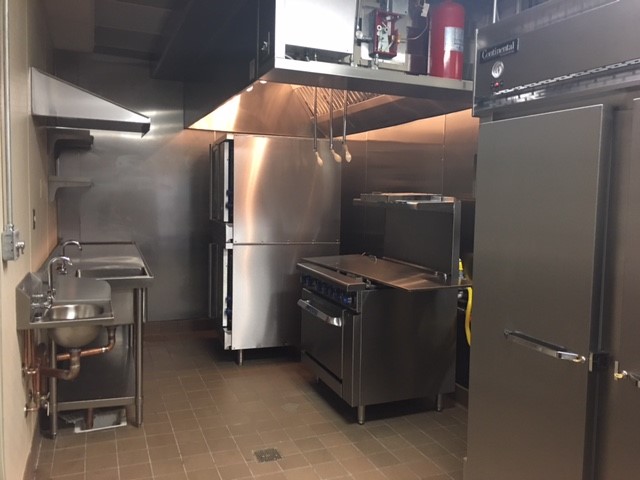
You are a GUI agent. You are given a task and a screenshot of the screen. Output one action in this format:
    pyautogui.click(x=<x>, y=<y>)
    Task: Click on the fire extinguisher
    
    Given the screenshot: What is the action you would take?
    pyautogui.click(x=435, y=31)